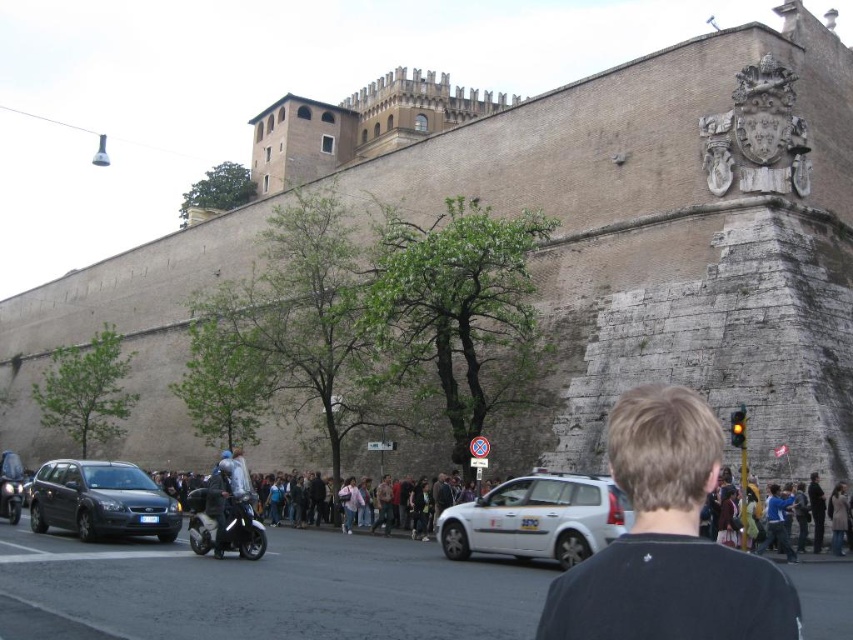
Question: Observing the image, what is the correct spatial positioning of black shirt at center in reference to dark blue leather jacket at center?

Choices:
 (A) right
 (B) left

Answer: (A)

Question: Does black shirt at center come in front of white matte hatchback at center?

Choices:
 (A) no
 (B) yes

Answer: (B)

Question: Which point appears closest to the camera in this image?

Choices:
 (A) (131, 516)
 (B) (225, 513)

Answer: (B)

Question: Which point is farther to the camera?

Choices:
 (A) (51, 492)
 (B) (706, 561)
 (C) (212, 484)
 (D) (624, 518)

Answer: (A)

Question: Which point is closer to the camera?

Choices:
 (A) (224, 458)
 (B) (115, 506)

Answer: (B)

Question: Does black shirt at center have a greater width compared to matte black car at lower left?

Choices:
 (A) no
 (B) yes

Answer: (A)